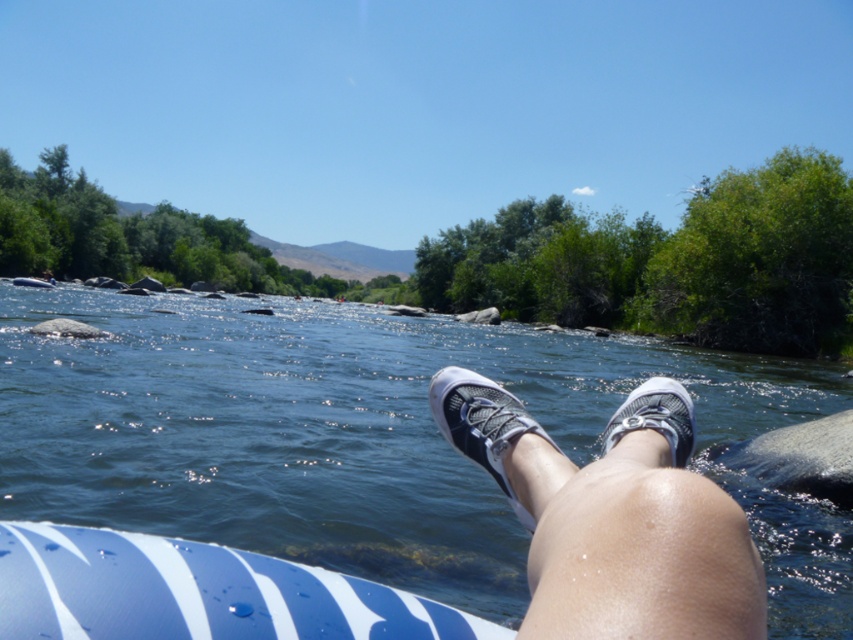
Which of these two, white mesh shoe at center or white mesh shoe at lower center, stands shorter?

Standing shorter between the two is white mesh shoe at center.

Does white mesh shoe at center have a smaller size compared to white mesh shoe at lower center?

Yes, white mesh shoe at center is smaller than white mesh shoe at lower center.

Does point (457, 404) come closer to viewer compared to point (602, 444)?

That is True.

Where is `white mesh shoe at center`? The image size is (853, 640). white mesh shoe at center is located at coordinates (482, 424).

Locate an element on the screen. The height and width of the screenshot is (640, 853). blue rubber raft at lower center is located at coordinates (326, 426).

Locate an element on the screen. blue rubber raft at lower center is located at coordinates (326, 426).

Between blue striped board at lower left and white mesh shoe at lower center, which one is positioned higher?

blue striped board at lower left

Which of these two, blue striped board at lower left or white mesh shoe at lower center, stands shorter?

blue striped board at lower left

This screenshot has height=640, width=853. What are the coordinates of `blue striped board at lower left` in the screenshot? It's located at (196, 593).

I want to click on blue striped board at lower left, so click(x=196, y=593).